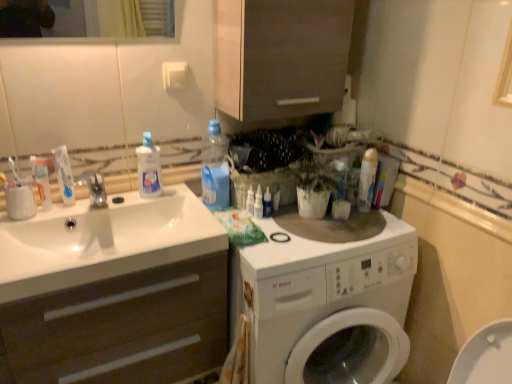
Locate an element on the screen. The image size is (512, 384). free location above white glossy washing machine at center (from a real-world perspective) is located at coordinates (321, 233).